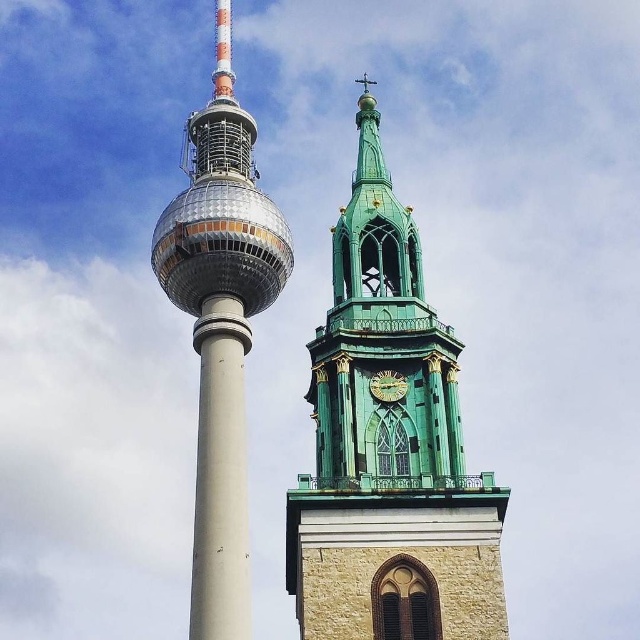
Measure the distance between shiny metallic tower at left and camera.

shiny metallic tower at left is 42.50 meters from camera.

Does shiny metallic tower at left appear on the left side of green stone clock at center?

Correct, you'll find shiny metallic tower at left to the left of green stone clock at center.

Does point (212, 152) lie behind point (394, 392)?

No, it is in front of (394, 392).

Where is `shiny metallic tower at left`? Image resolution: width=640 pixels, height=640 pixels. shiny metallic tower at left is located at coordinates (220, 326).

Is green stone clock tower at upper right wider than white concrete pillar at center?

No.

Can you confirm if green stone clock tower at upper right is positioned to the right of white concrete pillar at center?

Yes, green stone clock tower at upper right is to the right of white concrete pillar at center.

Consider the image. Who is more forward, (324, 362) or (209, 445)?

Point (209, 445)

You are a GUI agent. You are given a task and a screenshot of the screen. Output one action in this format:
    pyautogui.click(x=<x>, y=<y>)
    Task: Click on the green stone clock tower at upper right
    The width and height of the screenshot is (640, 640).
    Given the screenshot: What is the action you would take?
    pyautogui.click(x=388, y=445)

Is green stone clock tower at upper right bigger than green stone clock at center?

Yes.

Which is more to the right, green stone clock tower at upper right or green stone clock at center?

Positioned to the right is green stone clock at center.

Who is more distant from viewer, (436, 634) or (385, 388)?

Point (385, 388)

The width and height of the screenshot is (640, 640). What are the coordinates of `green stone clock tower at upper right` in the screenshot? It's located at (388, 445).